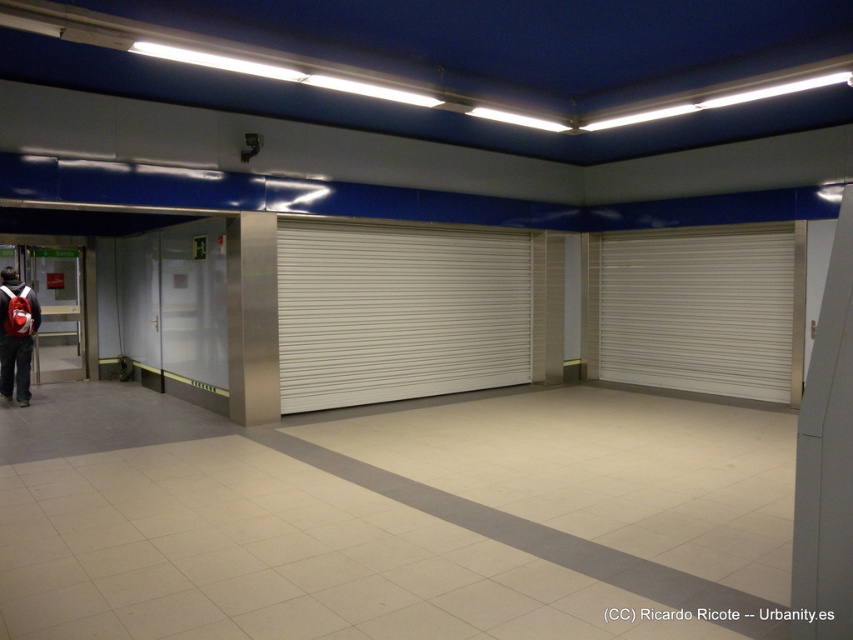
Question: Which point appears closest to the camera in this image?

Choices:
 (A) (779, 276)
 (B) (7, 292)

Answer: (B)

Question: From the image, what is the correct spatial relationship of white metallic blind at right in relation to matte red backpack at lower left?

Choices:
 (A) below
 (B) above

Answer: (B)

Question: Estimate the real-world distances between objects in this image. Which object is farther from the white metallic blind at center?

Choices:
 (A) matte red backpack at lower left
 (B) white metallic blind at right

Answer: (A)

Question: Is white metallic blind at right smaller than matte red backpack at lower left?

Choices:
 (A) no
 (B) yes

Answer: (A)

Question: Can you confirm if white metallic blind at right is wider than matte red backpack at lower left?

Choices:
 (A) no
 (B) yes

Answer: (B)

Question: Estimate the real-world distances between objects in this image. Which object is farther from the white metallic blind at center?

Choices:
 (A) matte red backpack at lower left
 (B) white metallic blind at right

Answer: (A)